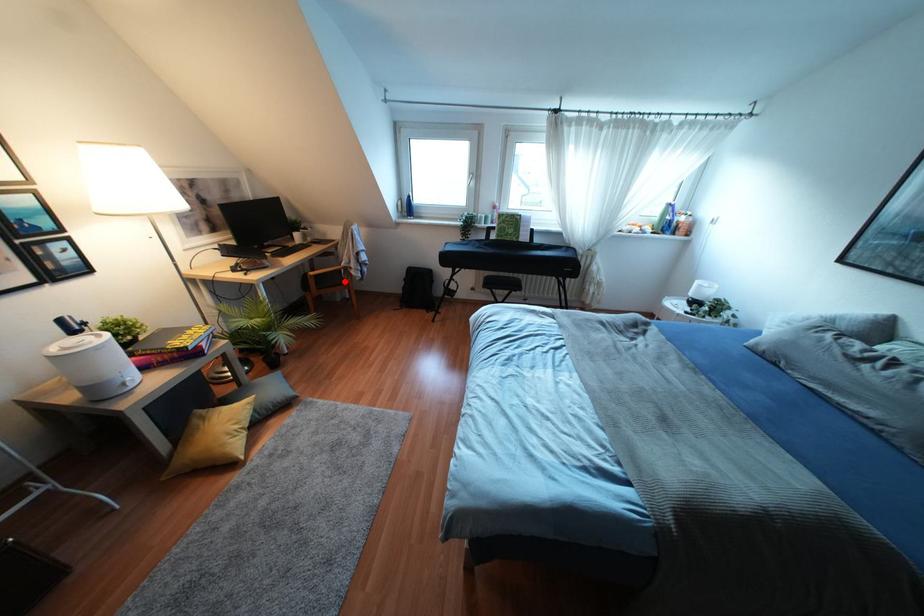
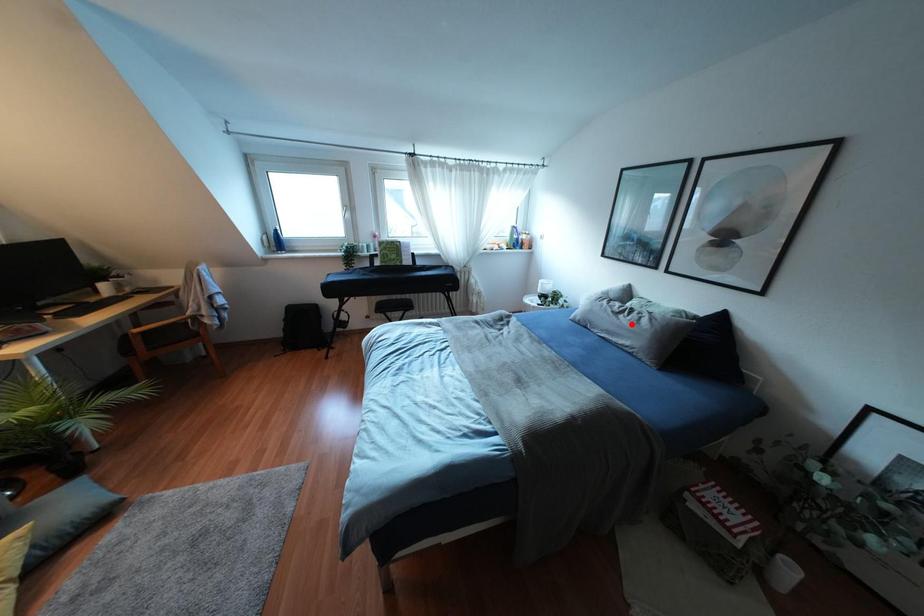
I am providing you with two images of the same scene from different viewpoints. A red point is marked on the first image and another point is marked on the second image. Does the point marked in image1 correspond to the same location as the one in image2?

No